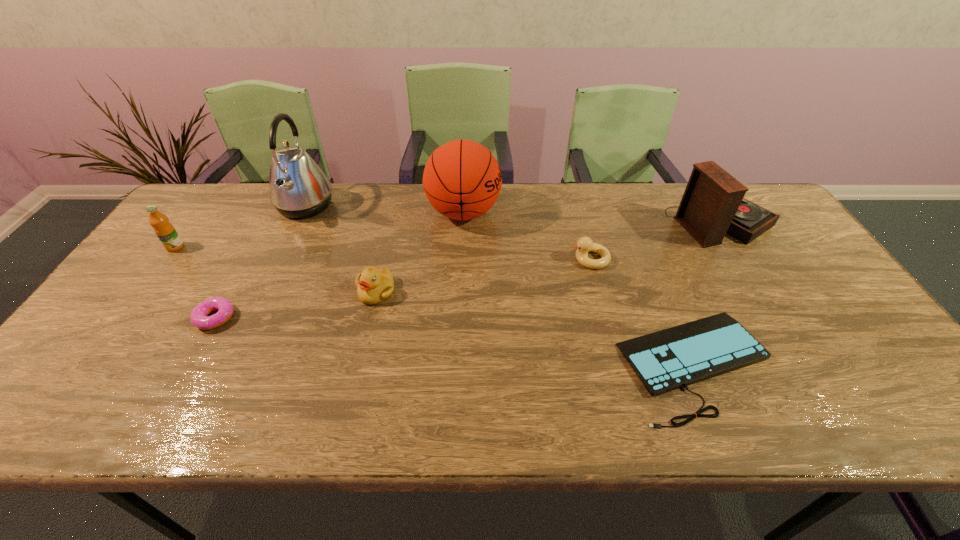
I want to click on free spot that satisfies the following two spatial constraints: 1. from the spout of the tallest object; 2. on the front side of the second shortest object, so click(x=252, y=318).

You are a GUI agent. You are given a task and a screenshot of the screen. Output one action in this format:
    pyautogui.click(x=<x>, y=<y>)
    Task: Click on the vacant area that satisfies the following two spatial constraints: 1. on the side with logo of the fifth object from left to right; 2. on the right side of the phonograph record
    This screenshot has width=960, height=540.
    Given the screenshot: What is the action you would take?
    pyautogui.click(x=463, y=221)

Identify the location of vacant area in the image that satisfies the following two spatial constraints: 1. from the spout of the tallest object; 2. on the left side of the shortest object. (230, 364).

This screenshot has width=960, height=540. I want to click on vacant space that satisfies the following two spatial constraints: 1. at the beak of the farther duckling; 2. on the left side of the shortest object, so click(x=617, y=364).